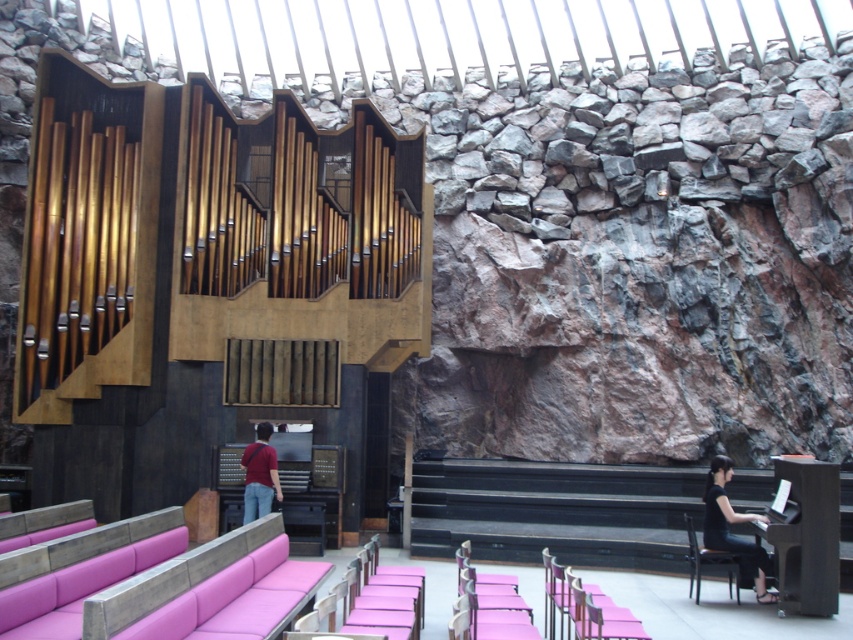
Question: Is black fabric at lower right below matte red shirt at center?

Choices:
 (A) no
 (B) yes

Answer: (B)

Question: Which object appears farthest from the camera in this image?

Choices:
 (A) black fabric at lower right
 (B) matte red shirt at center

Answer: (B)

Question: Among these objects, which one is nearest to the camera?

Choices:
 (A) black fabric at lower right
 (B) matte red shirt at center

Answer: (A)

Question: Is black fabric at lower right above matte red shirt at center?

Choices:
 (A) no
 (B) yes

Answer: (A)

Question: Does black fabric at lower right have a lesser width compared to matte red shirt at center?

Choices:
 (A) yes
 (B) no

Answer: (B)